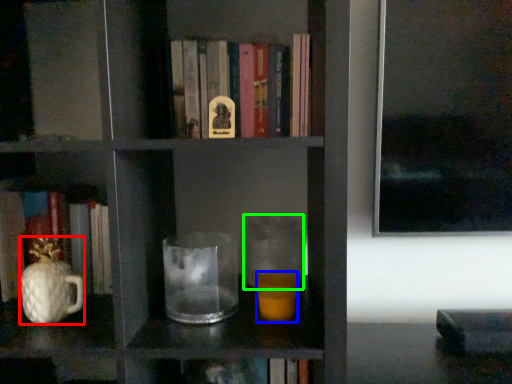
Question: Which object is the farthest from glass vase (highlighted by a red box)? Choose among these: candle holder (highlighted by a blue box) or glass jar (highlighted by a green box).

Choices:
 (A) candle holder
 (B) glass jar

Answer: (B)